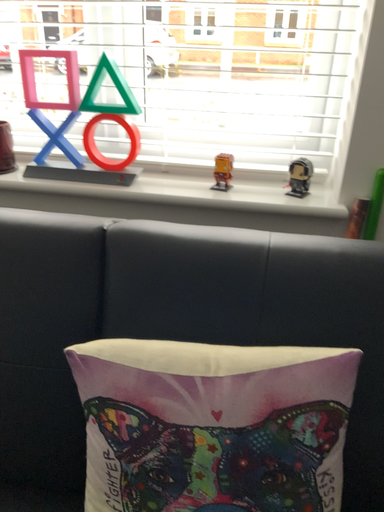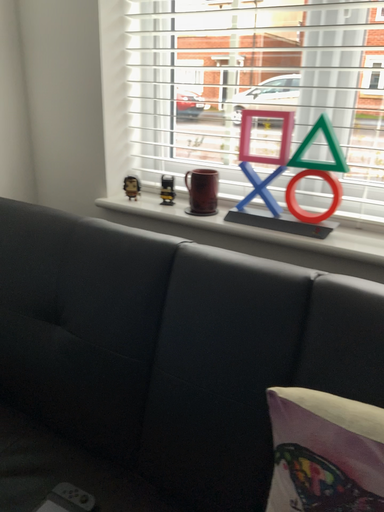
Question: How did the camera likely rotate when shooting the video?

Choices:
 (A) rotated downward
 (B) rotated upward

Answer: (B)